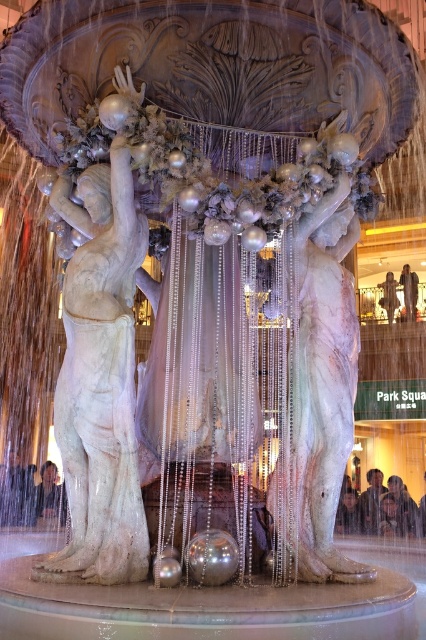
Question: Which point is farther to the camera?

Choices:
 (A) (298, 476)
 (B) (103, 284)

Answer: (B)

Question: Does white marble statue at left have a smaller size compared to white marble statue at center?

Choices:
 (A) yes
 (B) no

Answer: (B)

Question: Which object is closer to the camera taking this photo?

Choices:
 (A) white marble statue at center
 (B) white marble statue at left

Answer: (B)

Question: Can you confirm if white marble statue at left is smaller than white marble statue at center?

Choices:
 (A) yes
 (B) no

Answer: (B)

Question: Which of the following is the closest to the observer?

Choices:
 (A) 104,316
 (B) 348,332

Answer: (A)

Question: Is white marble statue at left positioned at the back of white marble statue at center?

Choices:
 (A) no
 (B) yes

Answer: (A)